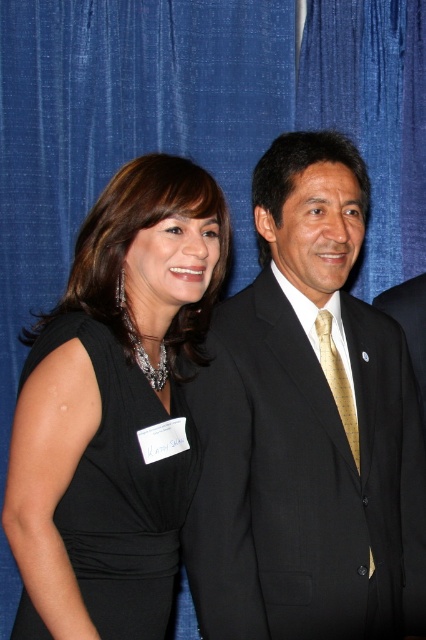
Who is lower down, black suit at right or gold silk tie at center?

Positioned lower is gold silk tie at center.

In the scene shown: Between black suit at right and gold silk tie at center, which one has less height?

With less height is gold silk tie at center.

Is point (215, 490) in front of point (322, 308)?

Yes, it is in front of point (322, 308).

Where is `black suit at right`? black suit at right is located at coordinates (307, 428).

Can you confirm if black matte dress at left is thinner than gold woven tie at center?

In fact, black matte dress at left might be wider than gold woven tie at center.

Consider the image. Can you confirm if black matte dress at left is taller than gold woven tie at center?

Indeed, black matte dress at left has a greater height compared to gold woven tie at center.

Identify the location of black matte dress at left. 121,492.

What are the coordinates of `black matte dress at left` in the screenshot? It's located at (121, 492).

Does black suit at right have a lesser height compared to matte black suit at center?

No, black suit at right is not shorter than matte black suit at center.

Does black suit at right have a greater width compared to matte black suit at center?

Indeed, black suit at right has a greater width compared to matte black suit at center.

Image resolution: width=426 pixels, height=640 pixels. In order to click on black suit at right in this screenshot , I will do `click(307, 428)`.